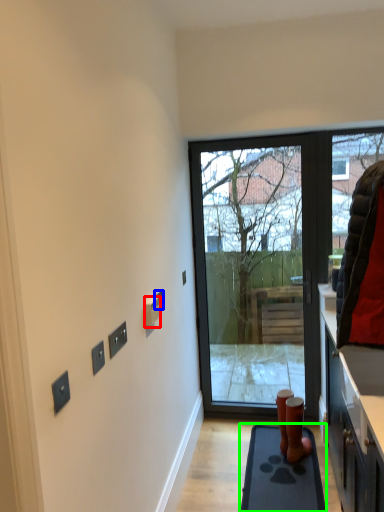
Question: Which object is positioned farthest from electric outlet (highlighted by a red box)? Select from electric outlet (highlighted by a blue box) and ramp (highlighted by a green box).

Choices:
 (A) electric outlet
 (B) ramp

Answer: (B)